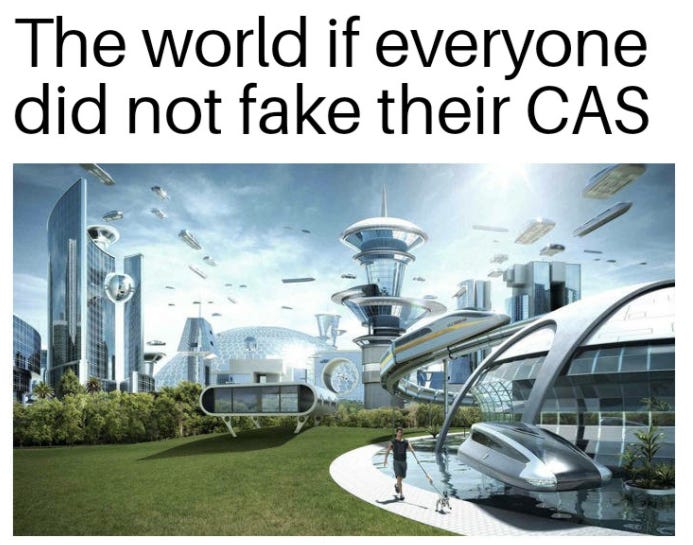
Identify the location of plant. (649, 469).